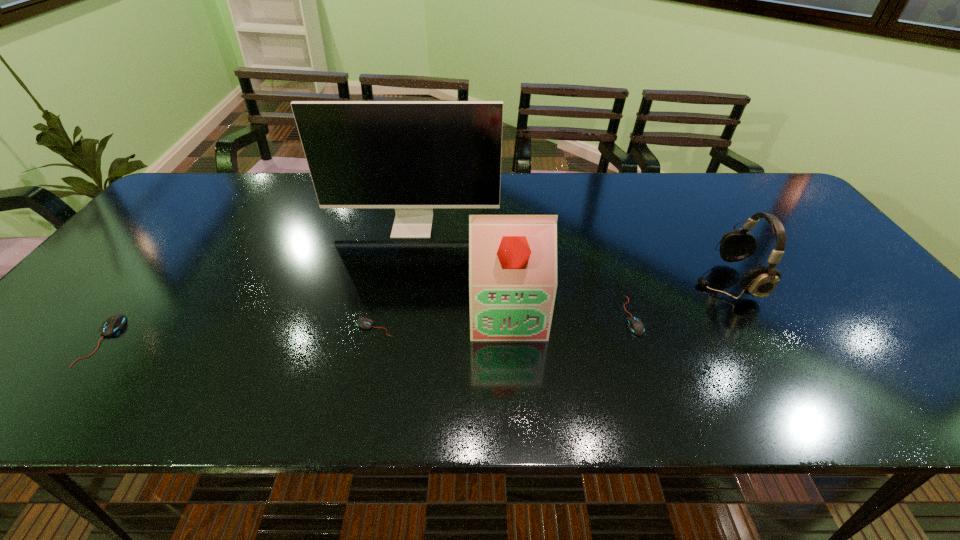
The width and height of the screenshot is (960, 540). Identify the location of soya milk at the near edge. (x=512, y=257).

This screenshot has height=540, width=960. What are the coordinates of `object that is at the left edge` in the screenshot? It's located at (112, 324).

Where is `object that is at the near left corner`? The height and width of the screenshot is (540, 960). object that is at the near left corner is located at coordinates (112, 324).

You are a GUI agent. You are given a task and a screenshot of the screen. Output one action in this format:
    pyautogui.click(x=<x>, y=<y>)
    Task: Click on the free spot at the far edge of the desktop
    The height and width of the screenshot is (540, 960).
    Given the screenshot: What is the action you would take?
    pyautogui.click(x=590, y=186)

I want to click on vacant area at the near edge of the desktop, so click(x=575, y=363).

This screenshot has width=960, height=540. Identify the location of free space at the left edge of the desktop. (155, 224).

Locate an element on the screen. free space at the far left corner of the desktop is located at coordinates pyautogui.click(x=168, y=202).

Locate an element on the screen. vacant space at the near left corner of the desktop is located at coordinates (75, 340).

In the image, there is a desktop. Where is `vacant space at the far right corner`? vacant space at the far right corner is located at coordinates (756, 200).

The width and height of the screenshot is (960, 540). Find the location of `free spot between the soya milk and the leftmost mouse`. free spot between the soya milk and the leftmost mouse is located at coordinates (305, 326).